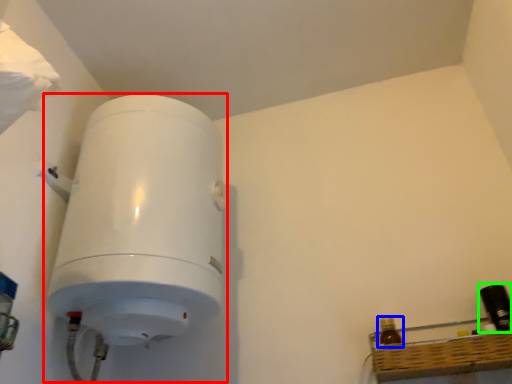
Question: Estimate the real-world distances between objects in this image. Which object is farther from appliance (highlighted by a red box), bottle (highlighted by a blue box) or bottle (highlighted by a green box)?

Choices:
 (A) bottle
 (B) bottle

Answer: (B)